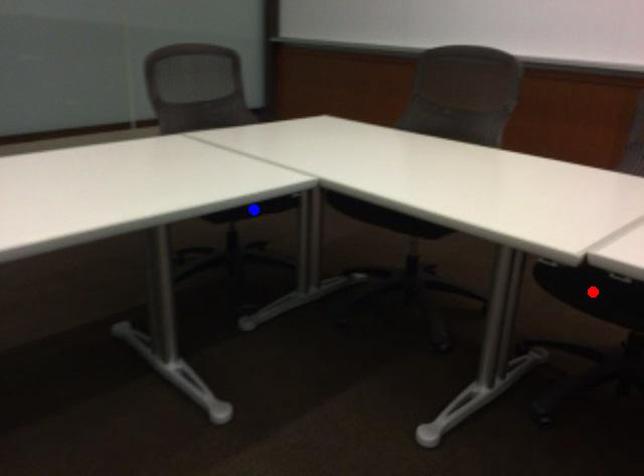
Question: In the image, two points are highlighted. Which point is nearer to the camera? Reply with the corresponding letter.

Choices:
 (A) blue point
 (B) red point

Answer: (B)